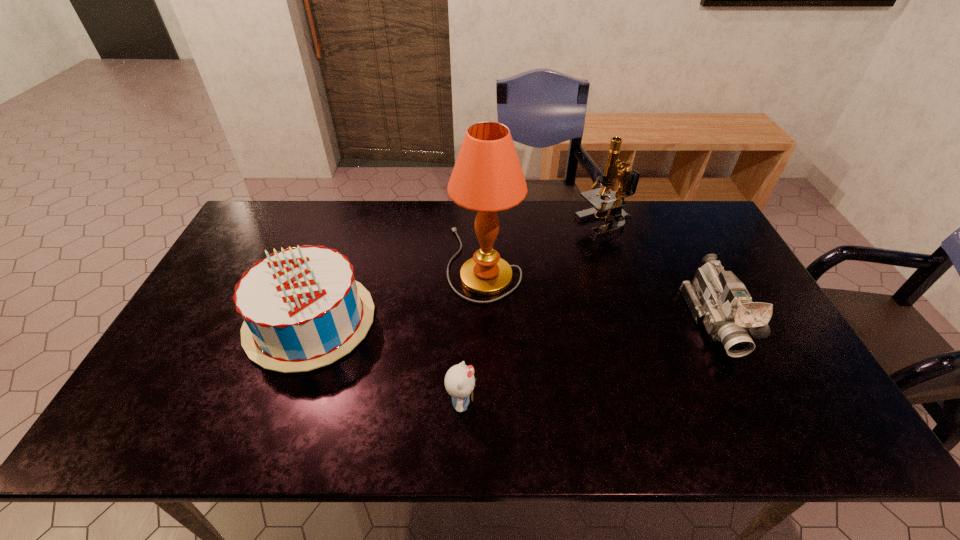
This screenshot has width=960, height=540. I want to click on the tallest object, so click(487, 177).

Identify the location of the fourth object from left to right. 628,179.

You are a GUI agent. You are given a task and a screenshot of the screen. Output one action in this format:
    pyautogui.click(x=<x>, y=<y>)
    Task: Click on the microscope
    The image size is (960, 540).
    Given the screenshot: What is the action you would take?
    pyautogui.click(x=628, y=179)

Image resolution: width=960 pixels, height=540 pixels. I want to click on the leftmost object, so [x=302, y=309].

This screenshot has height=540, width=960. What are the coordinates of `the rightmost object` in the screenshot? It's located at coord(716,298).

Locate an element on the screen. The image size is (960, 540). the shortest object is located at coordinates (459, 381).

Locate an element on the screen. the nearest object is located at coordinates (459, 381).

At what (x,y) coordinates should I click in order to perform the action: click on free location located 0.170m on the right of the lamp. Please return your answer as a coordinate pair (x, y). The image size is (960, 540). Looking at the image, I should click on (575, 263).

Identify the location of vacant space situated 0.330m at the eyepiece of the fourth shortest object. This screenshot has height=540, width=960. (481, 224).

The width and height of the screenshot is (960, 540). Identify the location of vacant space situated at the eyepiece of the fourth shortest object. (544, 224).